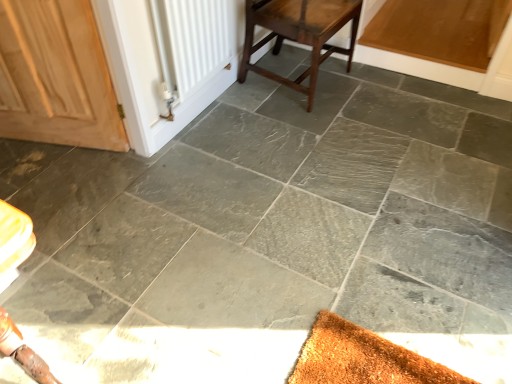
You are a GUI agent. You are given a task and a screenshot of the screen. Output one action in this format:
    pyautogui.click(x=<x>, y=<y>)
    Task: Click on the vacant area situated below dark brown wood stool at center (from a real-world perspective)
    
    Given the screenshot: What is the action you would take?
    pyautogui.click(x=294, y=91)